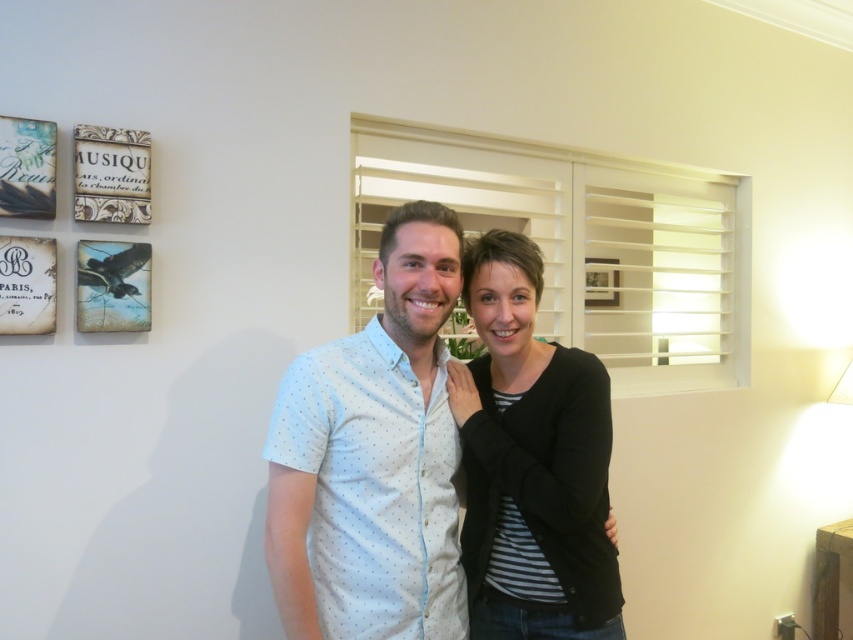
Question: Is black matte jacket at center smaller than wooden picture frame at center?

Choices:
 (A) no
 (B) yes

Answer: (A)

Question: Can you confirm if black matte jacket at center is positioned below wooden picture frame at center?

Choices:
 (A) yes
 (B) no

Answer: (A)

Question: Which object appears farthest from the camera in this image?

Choices:
 (A) wooden picture frame at center
 (B) white dotted shirt at center

Answer: (A)

Question: Considering the real-world distances, which object is farthest from the wooden picture frame at center?

Choices:
 (A) black matte jacket at center
 (B) white dotted shirt at center

Answer: (B)

Question: Which object is the farthest from the wooden picture frame at center?

Choices:
 (A) black matte jacket at center
 (B) white dotted shirt at center

Answer: (B)

Question: Can you confirm if white dotted shirt at center is positioned below wooden picture frame at center?

Choices:
 (A) no
 (B) yes

Answer: (B)